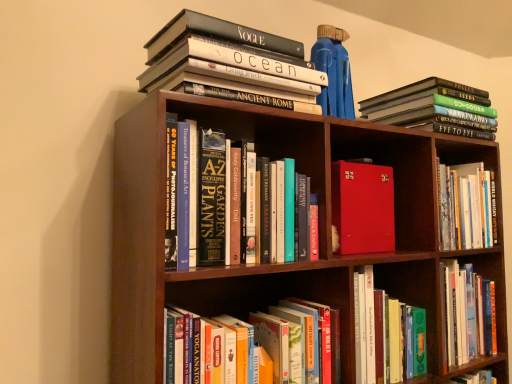
Question: Is red leather-bound book at center, which is counted as the 2th book, starting from the bottom, closer to camera compared to hardcover book at upper left, which is the 5th book in bottom-to-top order?

Choices:
 (A) yes
 (B) no

Answer: (B)

Question: From a real-world perspective, is red leather-bound book at center, which is the fourth book in top-to-bottom order, physically above hardcover book at upper left, the 1th book positioned from the top?

Choices:
 (A) no
 (B) yes

Answer: (A)

Question: Could you tell me if red leather-bound book at center, which is the fourth book in top-to-bottom order, is facing hardcover book at upper left, which is the 5th book in bottom-to-top order?

Choices:
 (A) no
 (B) yes

Answer: (A)

Question: Is red leather-bound book at center, which is the fourth book in top-to-bottom order, smaller than hardcover book at upper left, which is the 5th book in bottom-to-top order?

Choices:
 (A) no
 (B) yes

Answer: (B)

Question: Considering the relative sizes of red leather-bound book at center, which is counted as the 2th book, starting from the bottom, and hardcover book at upper left, the 1th book positioned from the top, in the image provided, is red leather-bound book at center, which is counted as the 2th book, starting from the bottom, shorter than hardcover book at upper left, the 1th book positioned from the top,?

Choices:
 (A) yes
 (B) no

Answer: (B)

Question: From the image's perspective, would you say red leather-bound book at center, which is the fourth book in top-to-bottom order, is positioned over hardcover book at upper left, the 1th book positioned from the top?

Choices:
 (A) no
 (B) yes

Answer: (A)

Question: From a real-world perspective, is hardcover book at lower center, which ranks as the first book in bottom-to-top order, physically above hardcover book at center, marked as the 3th book in a bottom-to-top arrangement?

Choices:
 (A) no
 (B) yes

Answer: (A)

Question: Is hardcover book at lower center, which ranks as the first book in bottom-to-top order, placed right next to hardcover book at center, the third book positioned from the top?

Choices:
 (A) no
 (B) yes

Answer: (A)

Question: Does hardcover book at lower center, the 5th book positioned from the top, have a smaller size compared to hardcover book at center, marked as the 3th book in a bottom-to-top arrangement?

Choices:
 (A) no
 (B) yes

Answer: (A)

Question: Is hardcover book at lower center, which ranks as the first book in bottom-to-top order, wider than hardcover book at center, marked as the 3th book in a bottom-to-top arrangement?

Choices:
 (A) yes
 (B) no

Answer: (A)

Question: Considering the relative positions of hardcover book at lower center, the 5th book positioned from the top, and hardcover book at center, marked as the 3th book in a bottom-to-top arrangement, in the image provided, is hardcover book at lower center, the 5th book positioned from the top, to the right of hardcover book at center, marked as the 3th book in a bottom-to-top arrangement, from the viewer's perspective?

Choices:
 (A) yes
 (B) no

Answer: (A)

Question: Is hardcover book at lower center, the 5th book positioned from the top, at the left side of hardcover book at center, marked as the 3th book in a bottom-to-top arrangement?

Choices:
 (A) yes
 (B) no

Answer: (B)

Question: Can you confirm if hardcover book at upper left, the 1th book positioned from the top, is wider than hardcover book at lower center, the 5th book positioned from the top?

Choices:
 (A) yes
 (B) no

Answer: (A)